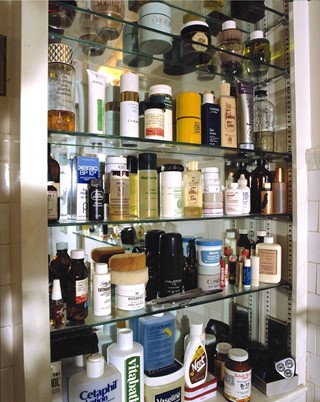
At what (x,y) coordinates should I click in order to perform the action: click on tile on wall. Please return your answer as a coordinate pair (x, y). The image size is (320, 402). Looking at the image, I should click on (313, 230), (6, 190).